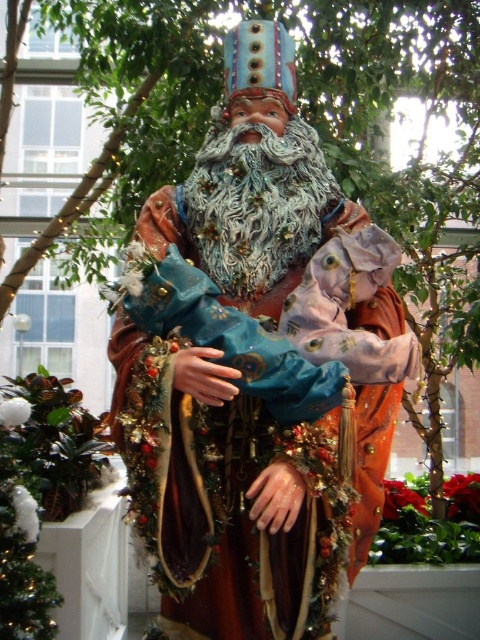
Does velvet-like orange robe at center appear over fuzzy fabric beard at center?

Incorrect, velvet-like orange robe at center is not positioned above fuzzy fabric beard at center.

Is point (305, 355) positioned behind point (331, 186)?

No.

This screenshot has height=640, width=480. What do you see at coordinates (256, 369) in the screenshot? I see `velvet-like orange robe at center` at bounding box center [256, 369].

This screenshot has width=480, height=640. I want to click on velvet-like orange robe at center, so click(256, 369).